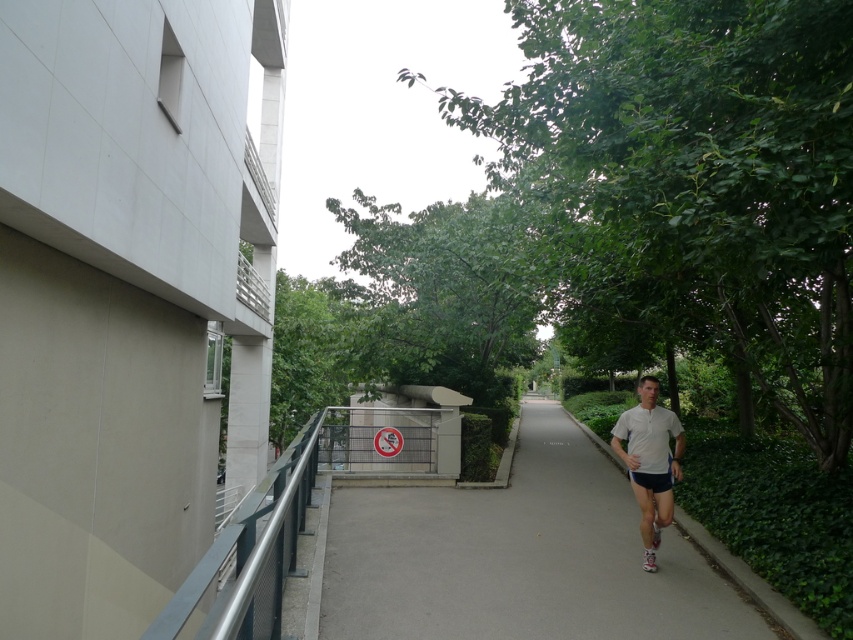
You are standing at the point marked as point (519, 556) in the image. What is the material under your feet?

The gray asphalt pavement at center is located at point (519, 556), so the material under your feet is asphalt.